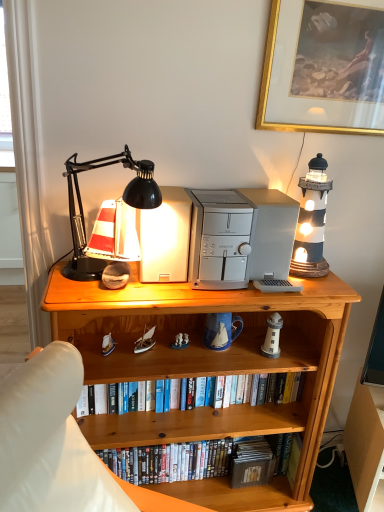
Question: From a real-world perspective, is white fabric curtain at left physically located above or below wooden bookcase at center?

Choices:
 (A) below
 (B) above

Answer: (B)

Question: Would you say white fabric curtain at left is to the left or to the right of wooden bookcase at center in the picture?

Choices:
 (A) right
 (B) left

Answer: (B)

Question: Which object is positioned farthest from the wooden bookcase at center?

Choices:
 (A) white fabric curtain at left
 (B) black matte desk lamp at upper left
 (C) light brown wood at lower right
 (D) gold-framed painting at upper right
 (E) silver metallic desktop computer at center, the second appliance from the left

Answer: (D)

Question: Based on their relative distances, which object is nearer to the wooden bookcase at center?

Choices:
 (A) black matte desk lamp at upper left
 (B) white plastic toaster at center, the 1th appliance positioned from the left
 (C) gold-framed painting at upper right
 (D) silver metallic desktop computer at center, acting as the 1th appliance starting from the right
 (E) light brown wood at lower right

Answer: (D)